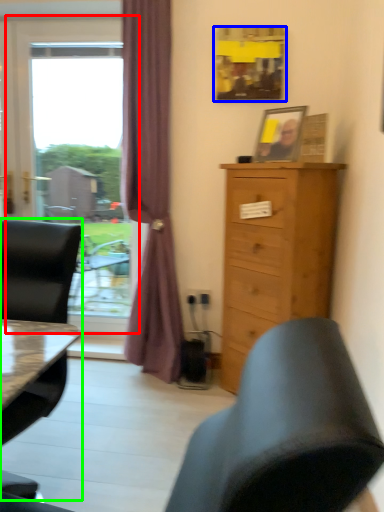
Question: Which object is the closest to the window (highlighted by a red box)? Choose among these: picture frame (highlighted by a blue box) or chair (highlighted by a green box).

Choices:
 (A) picture frame
 (B) chair

Answer: (A)